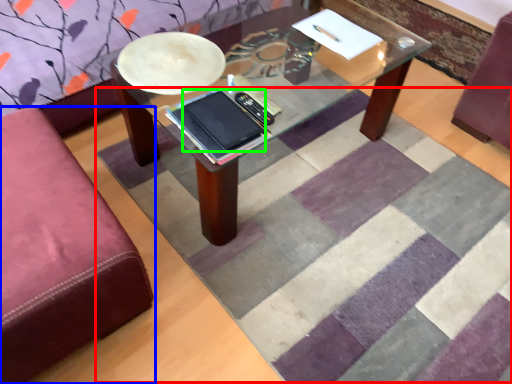
Question: Which object is the farthest from mat (highlighted by a red box)? Choose among these: studio couch (highlighted by a blue box) or tablet computer (highlighted by a green box).

Choices:
 (A) studio couch
 (B) tablet computer

Answer: (B)